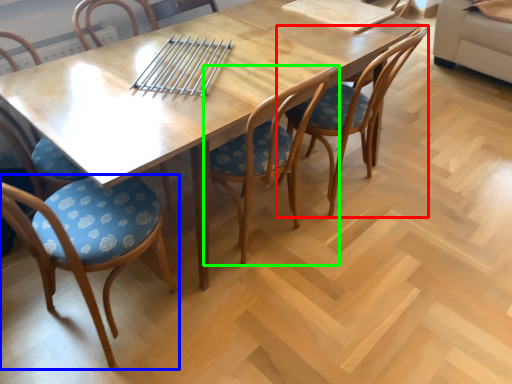
Question: Which object is positioned closest to chair (highlighted by a red box)? Select from chair (highlighted by a blue box) and chair (highlighted by a green box).

Choices:
 (A) chair
 (B) chair

Answer: (B)